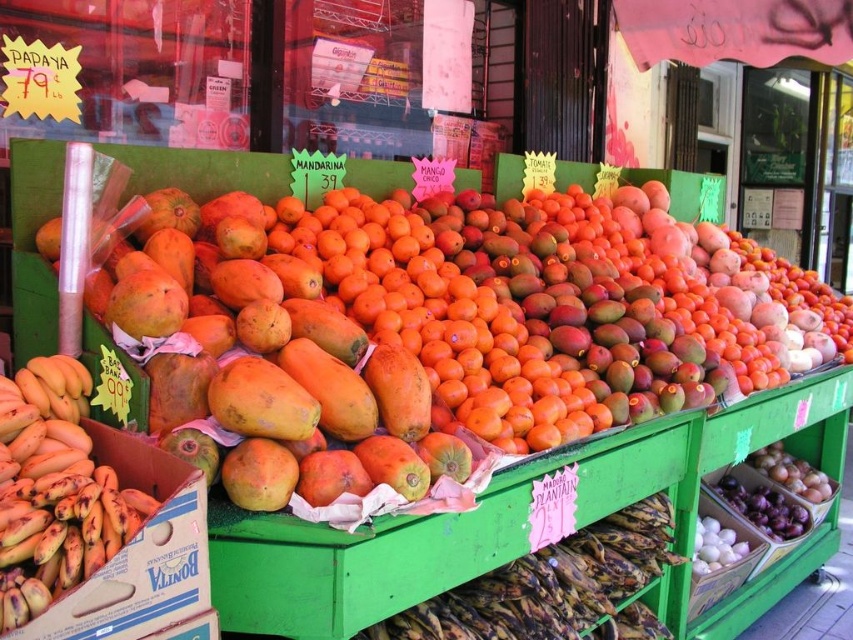
Question: Does ripe papaya at center have a lesser width compared to yellow matte bananas at left?

Choices:
 (A) no
 (B) yes

Answer: (A)

Question: Can you confirm if ripe papaya at center is bigger than yellow matte bananas at left?

Choices:
 (A) no
 (B) yes

Answer: (B)

Question: From the image, what is the correct spatial relationship of ripe papaya at center in relation to yellow matte bananas at left?

Choices:
 (A) left
 (B) right

Answer: (B)

Question: Which point is closer to the camera?

Choices:
 (A) (154, 432)
 (B) (115, 486)

Answer: (B)

Question: Which point is farther from the camera taking this photo?

Choices:
 (A) (80, 468)
 (B) (407, 433)

Answer: (B)